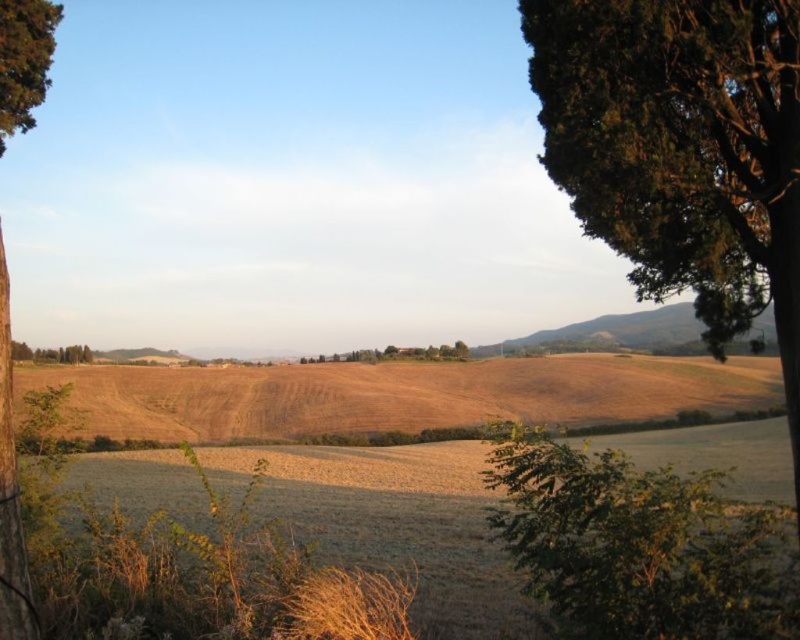
Question: Can you confirm if green leafy tree at right is smaller than green leafy tree at upper left?

Choices:
 (A) yes
 (B) no

Answer: (B)

Question: Estimate the real-world distances between objects in this image. Which object is farther from the green leafy tree at center?

Choices:
 (A) golden dry grass at center
 (B) green leafy tree at lower right
 (C) green leafy tree at left
 (D) green leafy tree at upper left

Answer: (C)

Question: Is green leafy tree at lower right to the right of green leafy tree at center from the viewer's perspective?

Choices:
 (A) no
 (B) yes

Answer: (B)

Question: Is golden dry grass at center smaller than green leafy tree at center?

Choices:
 (A) yes
 (B) no

Answer: (B)

Question: Which object is closer to the camera taking this photo?

Choices:
 (A) green leafy tree at upper left
 (B) green leafy tree at lower right
 (C) green leafy tree at center
 (D) golden dry grass at center

Answer: (B)

Question: Considering the real-world distances, which object is farthest from the green leafy tree at lower right?

Choices:
 (A) green leafy tree at left
 (B) green leafy tree at center
 (C) golden dry grass at center
 (D) green leafy tree at right

Answer: (B)